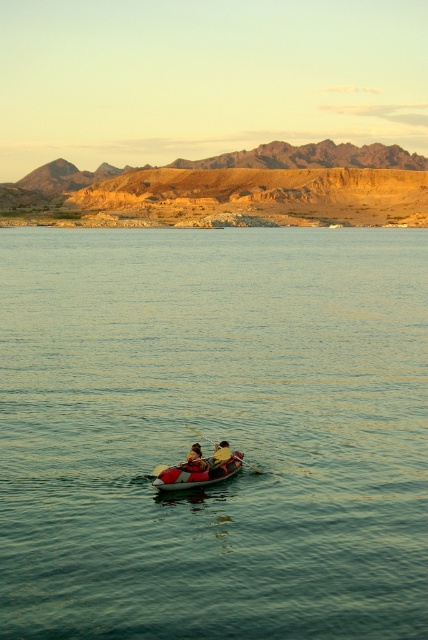
Between greenish-blue water at center and red rubber canoe at center, which one has less height?

red rubber canoe at center

Is greenish-blue water at center above red rubber canoe at center?

Yes.

Which is in front, point (281, 236) or point (190, 472)?

Point (190, 472) is in front.

The width and height of the screenshot is (428, 640). I want to click on greenish-blue water at center, so click(214, 433).

Can you confirm if red rubber canoe at center is bigger than yellow rubber kayak at center?

Yes.

Is point (169, 474) more distant than point (222, 442)?

No, it is in front of (222, 442).

This screenshot has width=428, height=640. Find the location of `red rubber canoe at center`. red rubber canoe at center is located at coordinates (196, 474).

Is yellow rubber kayak at center above smooth tan kayak at center?

No.

Who is higher up, yellow rubber kayak at center or smooth tan kayak at center?

Positioned higher is smooth tan kayak at center.

In order to click on yellow rubber kayak at center in this screenshot , I will do `click(219, 458)`.